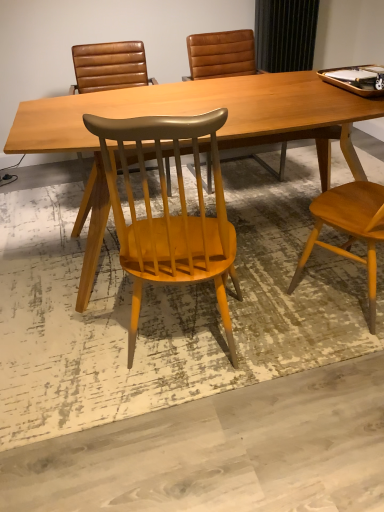
Where is `free space to the left of matte wood chair at center, positioned as the 1th chair in front-to-back order`? The height and width of the screenshot is (512, 384). free space to the left of matte wood chair at center, positioned as the 1th chair in front-to-back order is located at coordinates (71, 352).